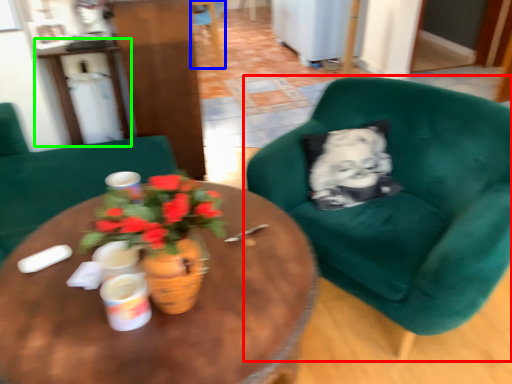
Question: Estimate the real-world distances between objects in this image. Which object is closer to chair (highlighted by a red box), chair (highlighted by a blue box) or table (highlighted by a green box)?

Choices:
 (A) chair
 (B) table

Answer: (B)